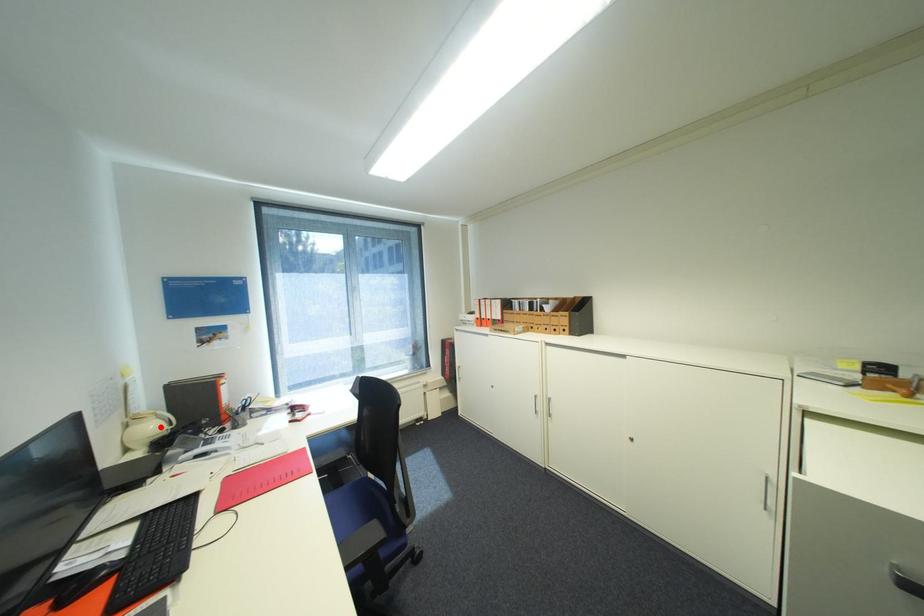
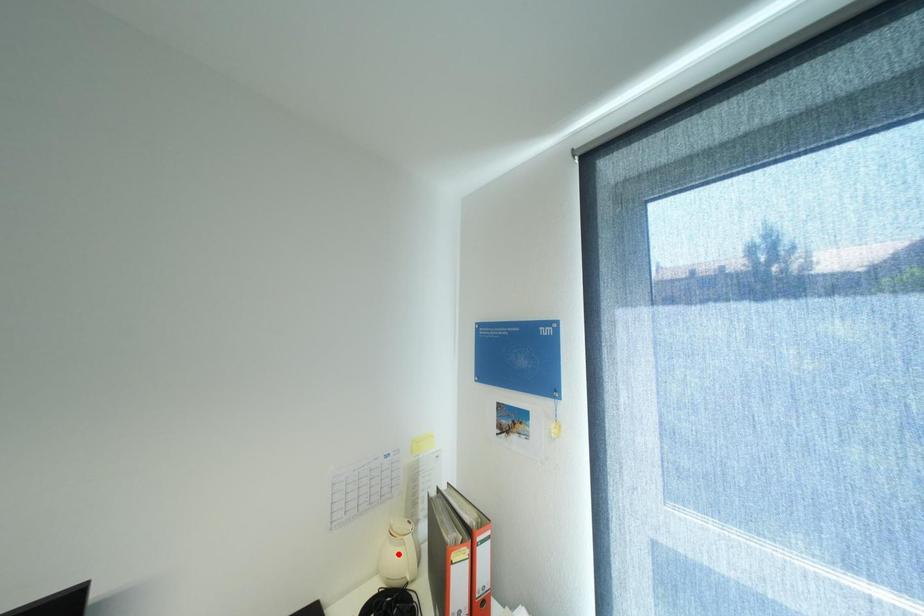
I am providing you with two images of the same scene from different viewpoints. A red point is marked on the first image and another point is marked on the second image. Are the points marked in image1 and image2 representing the same 3D position?

No